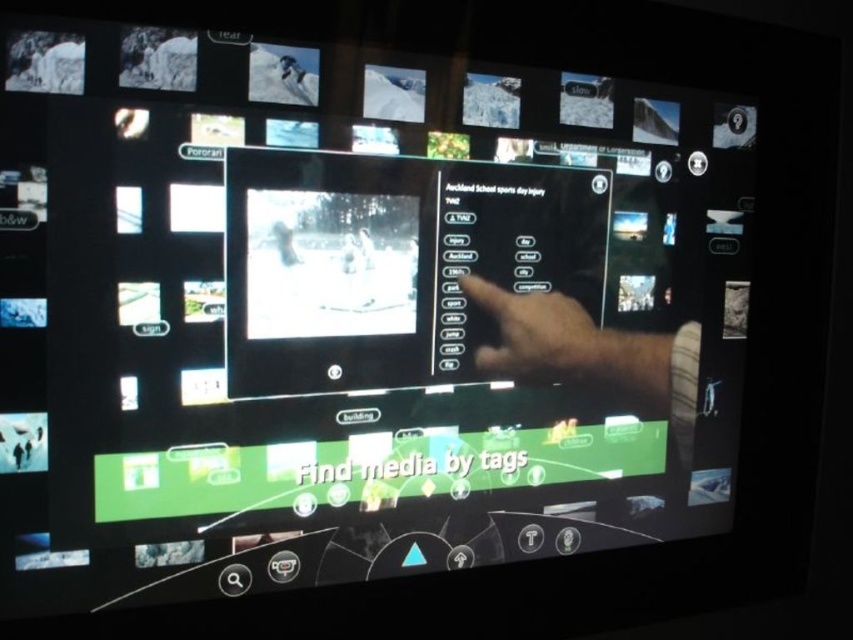
Is skinny hand at center behind skinny tan hand at center?

Yes.

Is point (563, 378) farther from viewer compared to point (601, 376)?

No, it is not.

Locate an element on the screen. Image resolution: width=853 pixels, height=640 pixels. skinny hand at center is located at coordinates (592, 355).